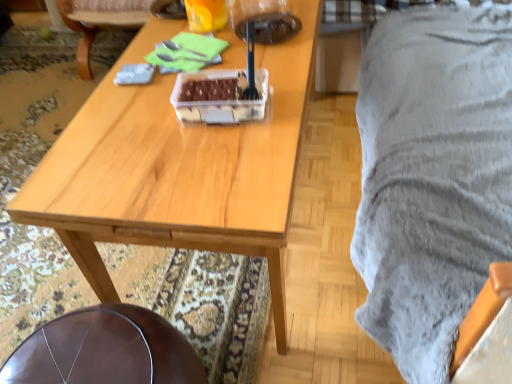
This screenshot has height=384, width=512. What do you see at coordinates (177, 168) in the screenshot? I see `wooden table at center` at bounding box center [177, 168].

What do you see at coordinates (104, 350) in the screenshot? Image resolution: width=512 pixels, height=384 pixels. I see `leather seat at lower left, which is the first chair from front to back` at bounding box center [104, 350].

This screenshot has width=512, height=384. Describe the element at coordinates (218, 96) in the screenshot. I see `translucent plastic container at center` at that location.

Locate an element on the screen. Image resolution: width=512 pixels, height=384 pixels. translucent plastic cup at upper center is located at coordinates click(x=206, y=15).

From a real-world perspective, is translucent plastic container at center under translucent plastic cup at upper center?

Correct, in the physical world, translucent plastic container at center is lower than translucent plastic cup at upper center.

In the scene shown: Relative to translucent plastic cup at upper center, is translucent plastic container at center in front or behind?

In the image, translucent plastic container at center appears in front of translucent plastic cup at upper center.

Which of these two, translucent plastic container at center or translucent plastic cup at upper center, is thinner?

translucent plastic cup at upper center.

From the image's perspective, is translucent plastic container at center positioned above or below translucent plastic cup at upper center?

translucent plastic container at center is situated lower than translucent plastic cup at upper center in the image.

Does wooden table at center lie behind translucent plastic cup at upper center?

No, wooden table at center is closer to the viewer.

From the image's perspective, is wooden table at center above or below translucent plastic cup at upper center?

From the image's perspective, wooden table at center appears below translucent plastic cup at upper center.

Which is more to the left, wooden table at center or translucent plastic cup at upper center?

From the viewer's perspective, translucent plastic cup at upper center appears more on the left side.

Where is `the 1st chair counting from the left side of the wooden table at center`? the 1st chair counting from the left side of the wooden table at center is located at coordinates (104, 350).

Does wooden table at center have a lesser height compared to leather seat at lower left, the second chair from the back?

No.

From the image's perspective, does wooden table at center appear higher than leather seat at lower left, the second chair from the back?

Indeed, from the image's perspective, wooden table at center is shown above leather seat at lower left, the second chair from the back.

In terms of height, does leather seat at lower left, the first chair positioned from the bottom, look taller or shorter compared to translucent plastic cup at upper center?

leather seat at lower left, the first chair positioned from the bottom, is taller than translucent plastic cup at upper center.

In the image, there is a leather seat at lower left, the first chair positioned from the bottom. Where is `coffee cup above it (from the image's perspective)`? This screenshot has width=512, height=384. coffee cup above it (from the image's perspective) is located at coordinates (206, 15).

From a real-world perspective, is leather seat at lower left, which appears as the second chair when viewed from the top, physically located above or below translucent plastic cup at upper center?

From a real-world perspective, leather seat at lower left, which appears as the second chair when viewed from the top, is physically below translucent plastic cup at upper center.

Considering the relative sizes of leather seat at lower left, the second chair from the back, and translucent plastic cup at upper center in the image provided, is leather seat at lower left, the second chair from the back, wider than translucent plastic cup at upper center?

Yes.

You are a GUI agent. You are given a task and a screenshot of the screen. Output one action in this format:
    pyautogui.click(x=<x>, y=<y>)
    Task: Click on the coffee cup on the right of the brown leather chair at center, the first chair from the top
    This screenshot has width=512, height=384.
    Given the screenshot: What is the action you would take?
    pyautogui.click(x=206, y=15)

Is brown leather chair at center, which appears as the second chair when viewed from the front, taller than translucent plastic cup at upper center?

Yes.

Would you say brown leather chair at center, the second chair in the bottom-to-top sequence, contains translucent plastic cup at upper center?

Actually, translucent plastic cup at upper center is outside brown leather chair at center, the second chair in the bottom-to-top sequence.

From the image's perspective, is translucent plastic cup at upper center on brown leather chair at center, the second chair in the bottom-to-top sequence?

No, from the image's perspective, translucent plastic cup at upper center is not above brown leather chair at center, the second chair in the bottom-to-top sequence.

Visually, is translucent plastic cup at upper center positioned to the left or to the right of brown leather chair at center, which appears as the second chair when viewed from the front?

translucent plastic cup at upper center is to the right of brown leather chair at center, which appears as the second chair when viewed from the front.

Can you confirm if translucent plastic cup at upper center is wider than brown leather chair at center, which ranks as the first chair in back-to-front order?

Incorrect, the width of translucent plastic cup at upper center does not surpass that of brown leather chair at center, which ranks as the first chair in back-to-front order.

Which of these two, translucent plastic cup at upper center or brown leather chair at center, which ranks as the first chair in back-to-front order, stands taller?

Standing taller between the two is brown leather chair at center, which ranks as the first chair in back-to-front order.

Is leather seat at lower left, which is the first chair from front to back, located within translucent plastic container at center?

That's incorrect, leather seat at lower left, which is the first chair from front to back, is not inside translucent plastic container at center.

Could you tell me if translucent plastic container at center is facing leather seat at lower left, the second chair from the back?

No, translucent plastic container at center is not aimed at leather seat at lower left, the second chair from the back.

Is point (183, 76) in front of point (175, 358)?

That is False.

From a real-world perspective, is translucent plastic container at center over leather seat at lower left, the second chair from the back?

Yes, from a real-world perspective, translucent plastic container at center is over leather seat at lower left, the second chair from the back

Find the location of a particular element. The width and height of the screenshot is (512, 384). food located on the right of translucent plastic cup at upper center is located at coordinates (218, 96).

Locate an element on the screen. coffee cup that is above the wooden table at center (from a real-world perspective) is located at coordinates (206, 15).

Based on their spatial positions, is translucent plastic container at center or leather seat at lower left, which is the first chair from front to back, closer to wooden table at center?

translucent plastic container at center is positioned closer to the anchor wooden table at center.

Considering their positions, is leather seat at lower left, the first chair positioned from the bottom, positioned further to wooden table at center than brown leather chair at center, which ranks as the first chair in back-to-front order?

The object further to wooden table at center is brown leather chair at center, which ranks as the first chair in back-to-front order.

Looking at the image, which one is located closer to brown leather chair at center, the first chair from the top, wooden table at center or translucent plastic container at center?

The object closer to brown leather chair at center, the first chair from the top, is wooden table at center.

Considering their positions, is leather seat at lower left, which appears as the second chair when viewed from the top, positioned further to brown leather chair at center, which appears as the second chair when viewed from the front, than translucent plastic cup at upper center?

The object further to brown leather chair at center, which appears as the second chair when viewed from the front, is leather seat at lower left, which appears as the second chair when viewed from the top.

From the image, which object appears to be nearer to translucent plastic container at center, translucent plastic cup at upper center or leather seat at lower left, the second chair from the back?

translucent plastic cup at upper center is positioned closer to the anchor translucent plastic container at center.

Which object lies further to the anchor point brown leather chair at center, which appears as the second chair when viewed from the front, translucent plastic container at center or leather seat at lower left, the second chair from the back?

leather seat at lower left, the second chair from the back.

When comparing their distances from translucent plastic container at center, does wooden table at center or brown leather chair at center, the first chair from the top, seem closer?

wooden table at center is closer to translucent plastic container at center.

When comparing their distances from leather seat at lower left, the second chair from the back, does brown leather chair at center, which ranks as the first chair in back-to-front order, or wooden table at center seem closer?

A: wooden table at center.

Where is `desk between brown leather chair at center, the first chair from the top, and leather seat at lower left, the first chair positioned from the bottom, vertically`? This screenshot has width=512, height=384. desk between brown leather chair at center, the first chair from the top, and leather seat at lower left, the first chair positioned from the bottom, vertically is located at coordinates (177, 168).

The height and width of the screenshot is (384, 512). I want to click on food positioned between wooden table at center and brown leather chair at center, which ranks as the first chair in back-to-front order, from near to far, so click(x=218, y=96).

The image size is (512, 384). What are the coordinates of `coffee cup between brown leather chair at center, which ranks as the first chair in back-to-front order, and leather seat at lower left, the second chair from the back, in the up-down direction` in the screenshot? It's located at (206, 15).

Identify the location of desk between translucent plastic cup at upper center and leather seat at lower left, which is the first chair from front to back, in the vertical direction. (177, 168).